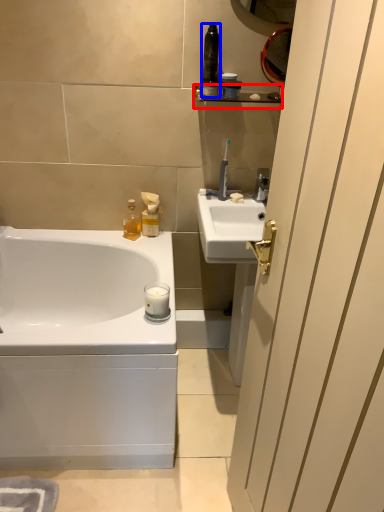
Question: Which object appears closest to the camera in this image, balustrade (highlighted by a red box) or toiletry (highlighted by a blue box)?

Choices:
 (A) balustrade
 (B) toiletry

Answer: (B)